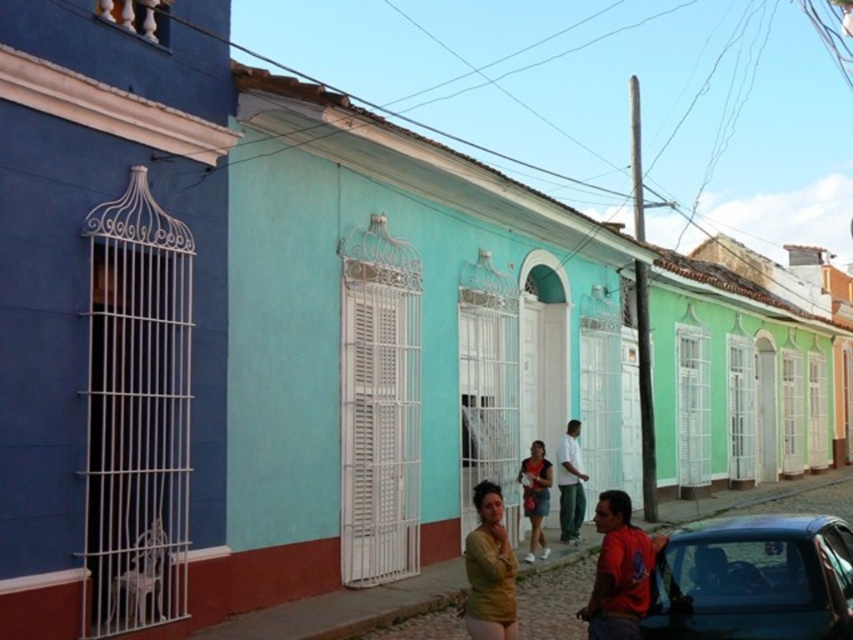
You are standing at the center of the street in this historic neighborhood. You notice a red cotton shirt at lower right. Where exactly is the red cotton shirt located in relation to your position?

The red cotton shirt at lower right is located at coordinates point (619, 572) relative to your position at the center of the street.

You are a photographer trying to capture both the red cotton shirt at lower right and the matte yellow shirt at center in a single frame. Which shirt should you focus on first to ensure both are in the shot?

The red cotton shirt at lower right is bigger than the matte yellow shirt at center, so you should focus on the red cotton shirt at lower right first to ensure both are in the shot.